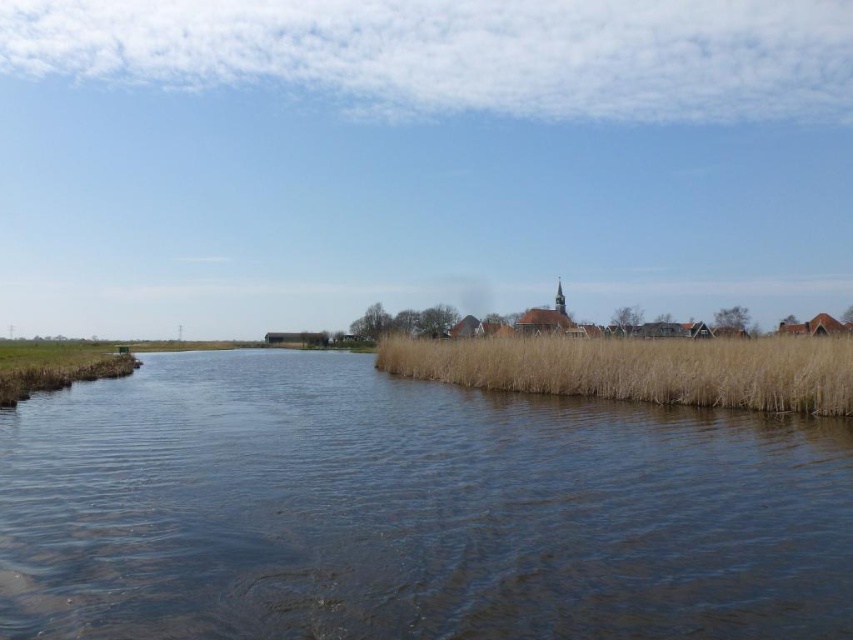
You are a photographer trying to capture the Dutch houses in the background. You have a camera with a 50mm lens that can focus on objects up to 2 meters away. You are currently standing at the edge of the water where the dry grass at center and the brown grassy reed at lower left are located. Which object is closer to you, and can you focus on the Dutch houses?

The brown grassy reed at lower left is closer to you than the dry grass at center. However, the Dutch houses are further away, so the 50mm lens can focus on them as they are beyond the 2 meters range.